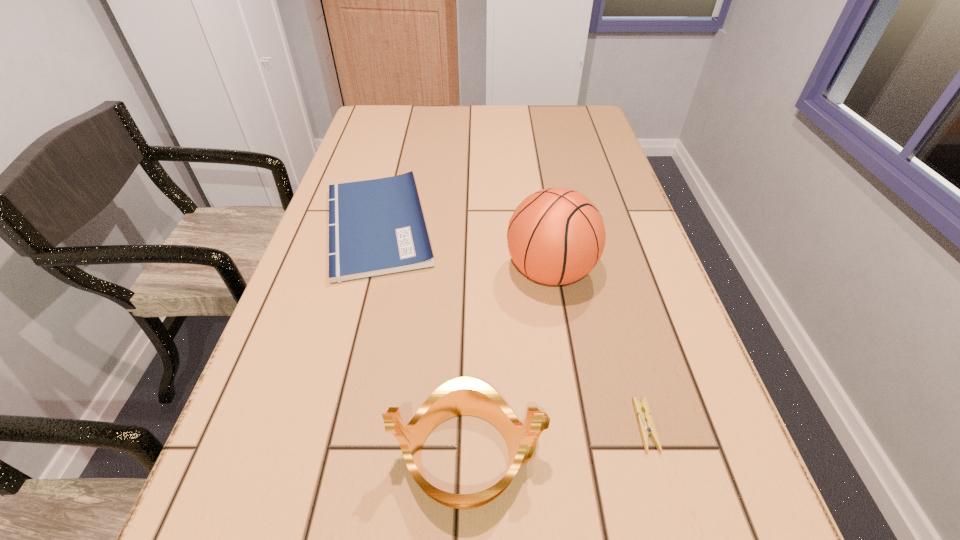
Where is `unoccupied position between the clothespin and the paperback book`? The width and height of the screenshot is (960, 540). unoccupied position between the clothespin and the paperback book is located at coordinates (512, 326).

Locate an element on the screen. empty space that is in between the second tallest object and the tallest object is located at coordinates (509, 363).

This screenshot has height=540, width=960. Identify the location of vacant area that lies between the clothespin and the third tallest object. (512, 326).

Locate an element on the screen. The width and height of the screenshot is (960, 540). vacant space that is in between the basketball and the shortest object is located at coordinates (597, 349).

The height and width of the screenshot is (540, 960). I want to click on free space between the tallest object and the shortest object, so click(x=597, y=349).

This screenshot has height=540, width=960. What are the coordinates of `empty space between the paperback book and the tallest object` in the screenshot? It's located at (464, 249).

Find the location of `unoccupied area between the clothespin and the third tallest object`. unoccupied area between the clothespin and the third tallest object is located at coordinates (512, 326).

This screenshot has height=540, width=960. I want to click on object that is the third closest to the clothespin, so click(376, 227).

Locate which object is the third closest to the basketball. Please provide its 2D coordinates. Your answer should be formatted as a tuple, i.e. [(x, y)], where the tuple contains the x and y coordinates of a point satisfying the conditions above.

[(464, 395)]

The image size is (960, 540). I want to click on free space that satisfies the following two spatial constraints: 1. on the front side of the shortest object; 2. on the left side of the second shortest object, so click(x=325, y=426).